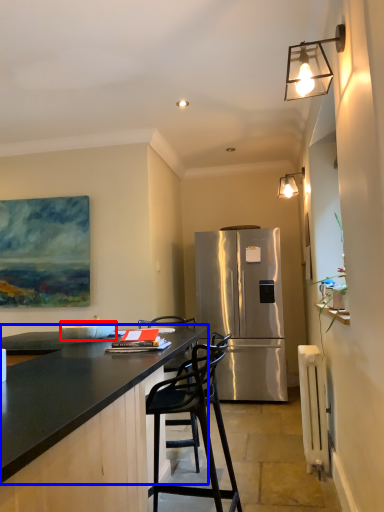
Question: Which object appears farthest to the camera in this image, bowl (highlighted by a red box) or countertop (highlighted by a blue box)?

Choices:
 (A) bowl
 (B) countertop

Answer: (A)